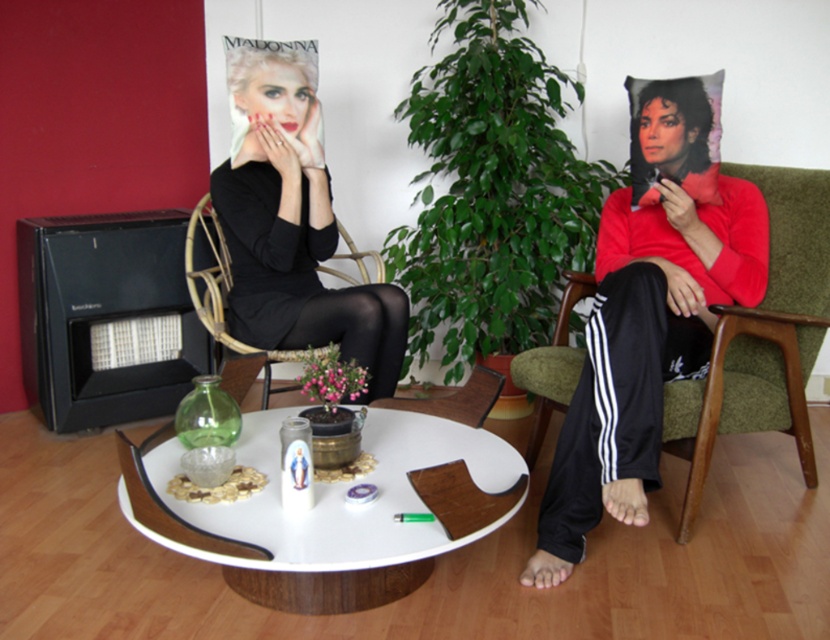
From the picture: Is black matte dress at center positioned in front of green fabric armchair at right?

No, black matte dress at center is behind green fabric armchair at right.

Is black matte dress at center thinner than green fabric armchair at right?

No, black matte dress at center is not thinner than green fabric armchair at right.

This screenshot has height=640, width=830. In order to click on black matte dress at center in this screenshot , I will do `click(293, 225)`.

Is point (247, 413) positioned after point (306, 67)?

No.

Does point (191, 536) come closer to viewer compared to point (249, 72)?

Yes, point (191, 536) is closer to viewer.

This screenshot has height=640, width=830. In order to click on white glossy round table at center in this screenshot , I will do `click(320, 513)`.

Identify the location of white glossy round table at center. This screenshot has height=640, width=830. point(320,513).

Does white glossy round table at center appear under woven rattan armchair at left?

Indeed, white glossy round table at center is positioned under woven rattan armchair at left.

Image resolution: width=830 pixels, height=640 pixels. What are the coordinates of `white glossy round table at center` in the screenshot? It's located at (320, 513).

You are a GUI agent. You are given a task and a screenshot of the screen. Output one action in this format:
    pyautogui.click(x=<x>, y=<y>)
    Task: Click on the white glossy round table at center
    
    Given the screenshot: What is the action you would take?
    pyautogui.click(x=320, y=513)